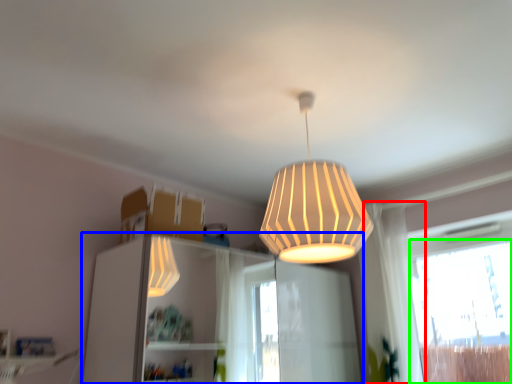
Question: Considering the real-world distances, which object is closest to curtain (highlighted by a red box)? dresser (highlighted by a blue box) or window (highlighted by a green box).

Choices:
 (A) dresser
 (B) window

Answer: (B)